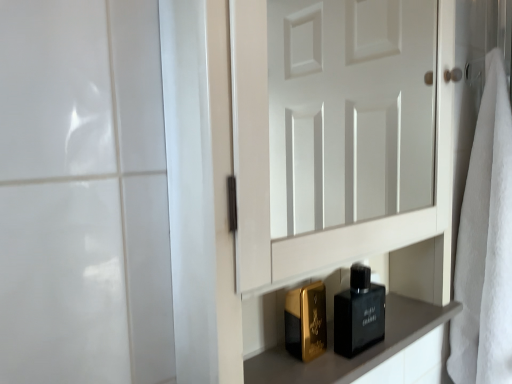
What are the coordinates of `matte black perfume bottles at lower center` in the screenshot? It's located at (356, 356).

Measure the distance between white soft towel at right and camera.

white soft towel at right and camera are 35.74 inches apart from each other.

You are a GUI agent. You are given a task and a screenshot of the screen. Output one action in this format:
    pyautogui.click(x=<x>, y=<y>)
    Task: Click on the matte black perfume bottles at lower center
    This screenshot has width=512, height=384.
    Given the screenshot: What is the action you would take?
    pyautogui.click(x=356, y=356)

Consider the image. From the image's perspective, who appears lower, matte black perfume bottles at lower center or black glass perfume at lower center?

matte black perfume bottles at lower center is shown below in the image.

From a real-world perspective, which is physically above, matte black perfume bottles at lower center or black glass perfume at lower center?

black glass perfume at lower center.

Is matte black perfume bottles at lower center not inside black glass perfume at lower center?

That's correct, matte black perfume bottles at lower center is outside of black glass perfume at lower center.

Between matte black perfume bottles at lower center and black glass perfume at lower center, which one has more height?

black glass perfume at lower center.

Is white soft towel at right shorter than black glass perfume at lower center?

Incorrect, the height of white soft towel at right does not fall short of that of black glass perfume at lower center.

Which of these two, white soft towel at right or black glass perfume at lower center, is bigger?

white soft towel at right.

Is white soft towel at right oriented away from black glass perfume at lower center?

No.

Which object is wider, white soft towel at right or black glass perfume at lower center?

white soft towel at right is wider.

Is point (498, 286) farther from camera compared to point (404, 338)?

Yes.

Is matte black perfume bottles at lower center a part of white soft towel at right?

Definitely not — matte black perfume bottles at lower center is not inside white soft towel at right.

Considering the sizes of objects white soft towel at right and matte black perfume bottles at lower center in the image provided, who is smaller, white soft towel at right or matte black perfume bottles at lower center?

matte black perfume bottles at lower center is smaller.

Is white soft towel at right in front of or behind matte black perfume bottles at lower center in the image?

white soft towel at right is behind matte black perfume bottles at lower center.

Can you see matte black perfume bottles at lower center touching white soft towel at right?

No.

Does matte black perfume bottles at lower center come in front of white soft towel at right?

Yes.

Could you tell me if matte black perfume bottles at lower center is facing white soft towel at right?

No, matte black perfume bottles at lower center does not turn towards white soft towel at right.

Is white soft towel at right at the back of black glass perfume at lower center?

black glass perfume at lower center is not turned away from white soft towel at right.

From the image's perspective, is black glass perfume at lower center on top of white soft towel at right?

No, from the image's perspective, black glass perfume at lower center is not over white soft towel at right.

Considering the positions of objects black glass perfume at lower center and white soft towel at right in the image provided, who is more to the left, black glass perfume at lower center or white soft towel at right?

Positioned to the left is black glass perfume at lower center.

Locate an element on the screen. cabinetry on the right of black glass perfume at lower center is located at coordinates (356, 356).

Is black glass perfume at lower center not near matte black perfume bottles at lower center?

No, black glass perfume at lower center is in close proximity to matte black perfume bottles at lower center.

Is the position of black glass perfume at lower center more distant than that of matte black perfume bottles at lower center?

Yes, the depth of black glass perfume at lower center is greater than that of matte black perfume bottles at lower center.

Is black glass perfume at lower center not inside matte black perfume bottles at lower center?

Absolutely, black glass perfume at lower center is external to matte black perfume bottles at lower center.

At what (x,y) coordinates should I click in order to perform the action: click on cabinetry that appears in front of the black glass perfume at lower center. Please return your answer as a coordinate pair (x, y). The image size is (512, 384). Looking at the image, I should click on (356, 356).

Where is `perfume that is below the white soft towel at right (from the image's perspective)`? The image size is (512, 384). perfume that is below the white soft towel at right (from the image's perspective) is located at coordinates (359, 313).

In the scene shown: Which object lies nearer to the anchor point white soft towel at right, black glass perfume at lower center or matte black perfume bottles at lower center?

matte black perfume bottles at lower center is positioned closer to the anchor white soft towel at right.

In the scene shown: Considering their positions, is black glass perfume at lower center positioned further to matte black perfume bottles at lower center than white soft towel at right?

Among the two, white soft towel at right is located further to matte black perfume bottles at lower center.

Based on their spatial positions, is white soft towel at right or black glass perfume at lower center further from matte black perfume bottles at lower center?

white soft towel at right is further to matte black perfume bottles at lower center.

Based on their spatial positions, is white soft towel at right or matte black perfume bottles at lower center further from black glass perfume at lower center?

The object further to black glass perfume at lower center is white soft towel at right.

When comparing their distances from black glass perfume at lower center, does matte black perfume bottles at lower center or white soft towel at right seem further?

Among the two, white soft towel at right is located further to black glass perfume at lower center.

Looking at the image, which one is located further to white soft towel at right, matte black perfume bottles at lower center or black glass perfume at lower center?

Based on the image, black glass perfume at lower center appears to be further to white soft towel at right.

Locate an element on the screen. The width and height of the screenshot is (512, 384). cabinetry between black glass perfume at lower center and white soft towel at right in the horizontal direction is located at coordinates (356, 356).